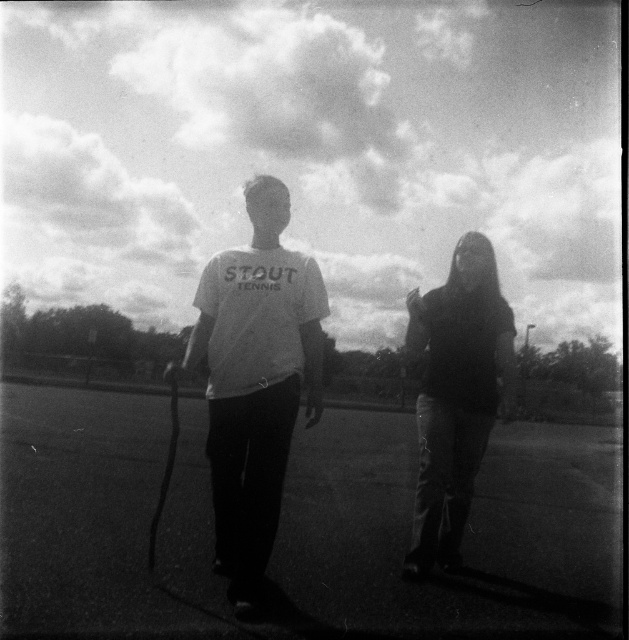
You are a fashion designer analyzing the image. You need to determine which item of clothing has a narrower width for a catalog description. Which one between the white matte shirt at center and the dark fabric jacket at center is narrower?

The white matte shirt at center has a narrower width than the dark fabric jacket at center according to the description.

You are a photographer trying to capture both the white matte shirt at center and the dark fabric jacket at center in a single frame. Since the camera can only focus on one object at a time, which object should you focus on to ensure the smaller one is in sharp detail?

The white matte shirt at center is smaller than the dark fabric jacket at center, so you should focus on the white matte shirt at center to ensure the smaller object is in sharp detail.

You are a photographer trying to capture a photo of two people in the scene. You need to ensure that the white matte shirt at center and the dark fabric jacket at center are both visible in the frame. Based on their positions, which object should you focus on first to include both in the shot?

The white matte shirt at center is to the left of the dark fabric jacket at center, so focusing on the white matte shirt at center first would allow you to adjust the frame to include both objects since they are positioned side by side horizontally.